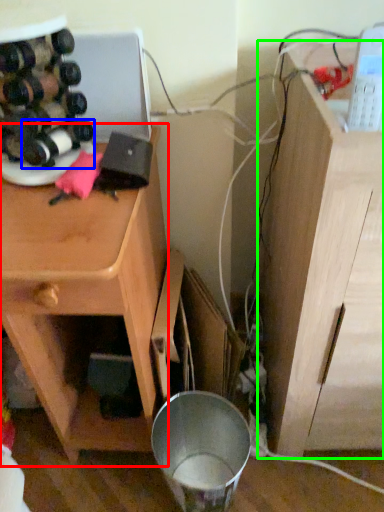
Question: Considering the real-world distances, which object is farthest from cabinetry (highlighted by a red box)? wine bottle (highlighted by a blue box) or vanity (highlighted by a green box)?

Choices:
 (A) wine bottle
 (B) vanity

Answer: (B)